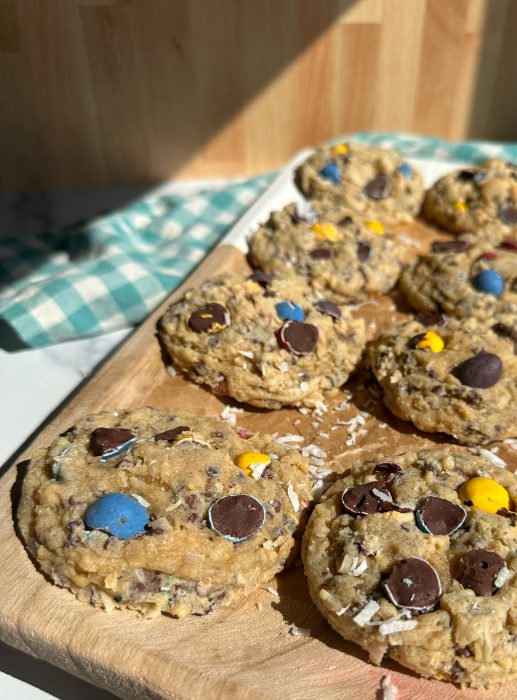
The height and width of the screenshot is (700, 517). Find the location of `white table`. white table is located at coordinates (38, 381).